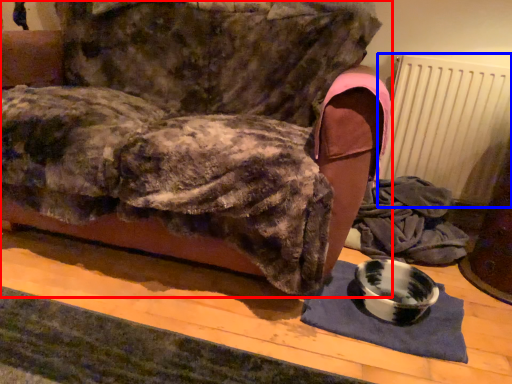
Question: Which object appears closest to the camera in this image, furniture (highlighted by a red box) or radiator (highlighted by a blue box)?

Choices:
 (A) furniture
 (B) radiator

Answer: (A)